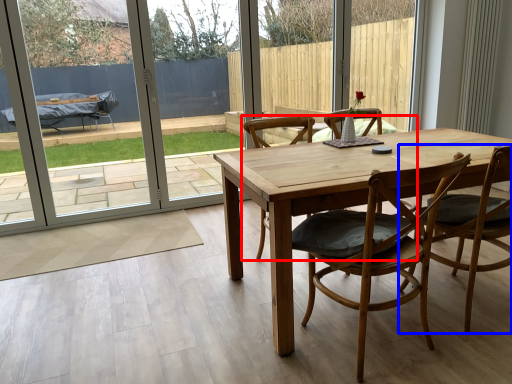
Question: Among these objects, which one is farthest to the camera, chair (highlighted by a red box) or chair (highlighted by a blue box)?

Choices:
 (A) chair
 (B) chair

Answer: (A)